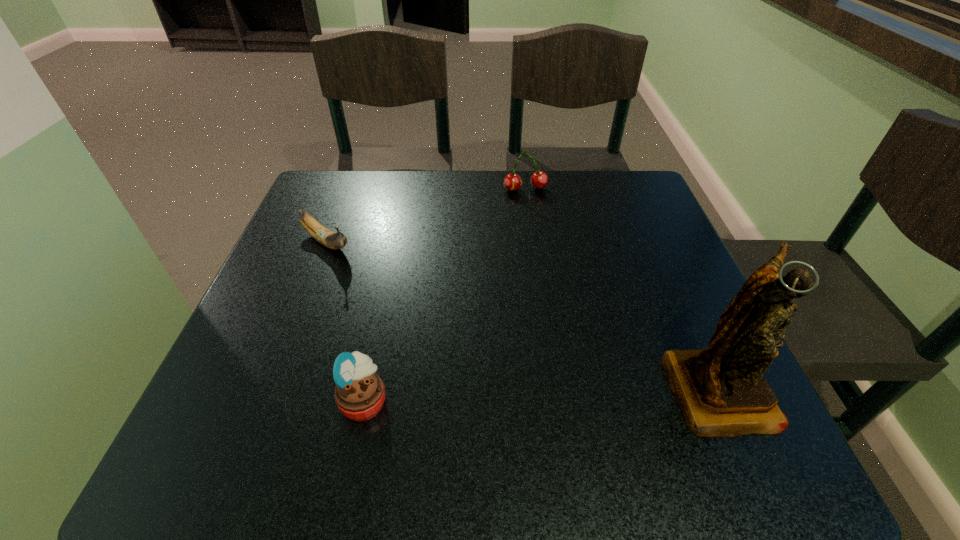
This screenshot has height=540, width=960. Identify the location of free location located on the peel of the shortest object. (357, 266).

Image resolution: width=960 pixels, height=540 pixels. In order to click on vacant space situated 0.390m with stems pointing upwards on the third object from left to right in this screenshot , I will do `click(564, 306)`.

In order to click on free location located with stems pointing upwards on the third object from left to right in this screenshot , I will do `click(533, 209)`.

Locate an element on the screen. The image size is (960, 540). free space located 0.200m with stems pointing upwards on the third object from left to right is located at coordinates (544, 245).

At what (x,y) coordinates should I click in order to perform the action: click on object that is at the far edge. Please return your answer as a coordinate pair (x, y). Looking at the image, I should click on pos(539,179).

I want to click on muffin present at the near edge, so click(359, 393).

Where is `figurine located in the near edge section of the desktop`? figurine located in the near edge section of the desktop is located at coordinates (721, 390).

The height and width of the screenshot is (540, 960). Identify the location of object positioned at the left edge. (328, 238).

Find the location of a particular element. object located in the right edge section of the desktop is located at coordinates (721, 390).

Where is `object that is at the near right corner`? object that is at the near right corner is located at coordinates (721, 390).